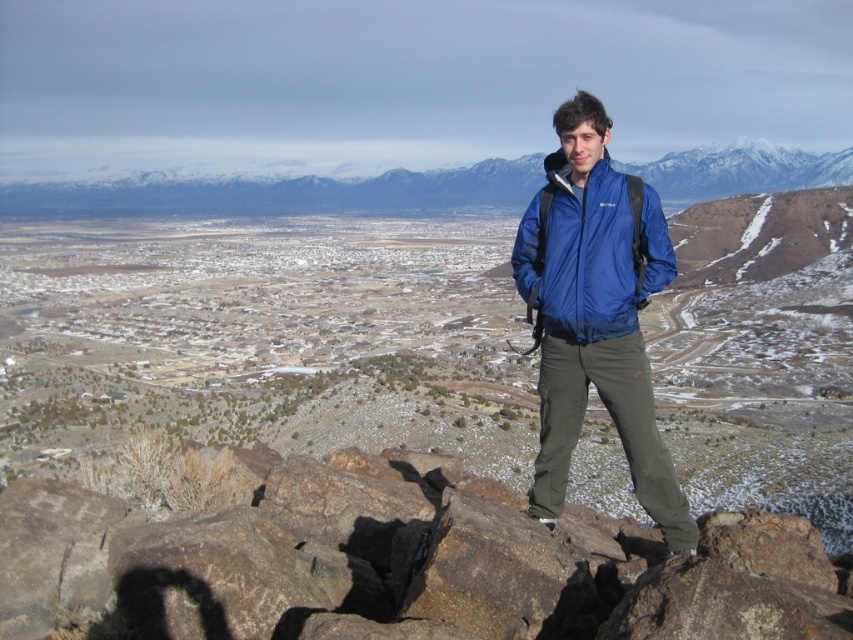
Between blue fabric jacket at center and snowy mountain range at upper center, which one has more height?

With more height is snowy mountain range at upper center.

Based on the photo, does blue fabric jacket at center have a smaller size compared to snowy mountain range at upper center?

Yes.

Is point (563, 493) farther from camera compared to point (721, 157)?

That is False.

Identify the location of blue fabric jacket at center. (596, 314).

Can you confirm if brown rough rock at center is bigger than blue waterproof jacket at center?

Yes, brown rough rock at center is bigger than blue waterproof jacket at center.

Can you confirm if brown rough rock at center is thinner than blue waterproof jacket at center?

In fact, brown rough rock at center might be wider than blue waterproof jacket at center.

Where is `brown rough rock at center`? brown rough rock at center is located at coordinates (393, 563).

Consider the image. Is brown rough rock at center shorter than blue fabric jacket at center?

Yes.

The image size is (853, 640). Identify the location of brown rough rock at center. (393, 563).